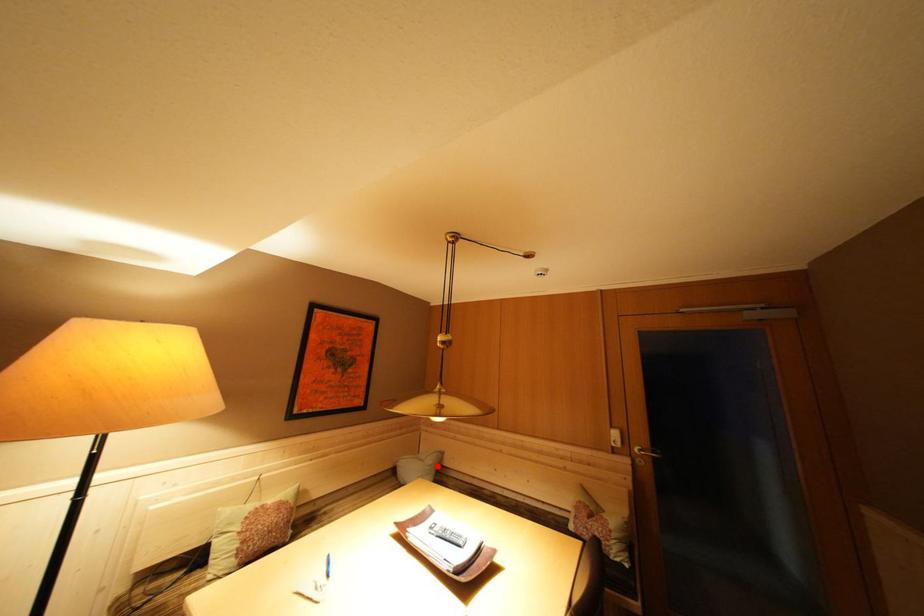
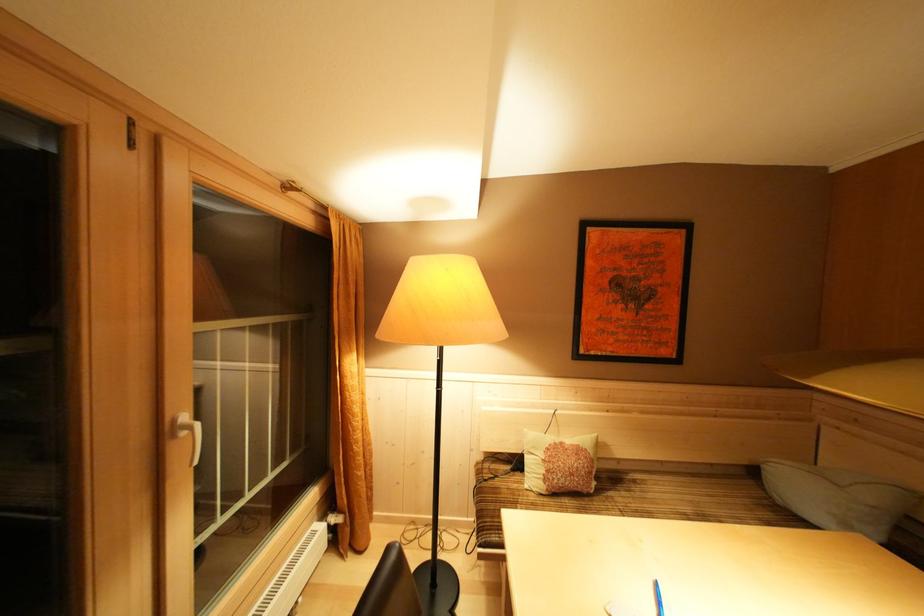
Question: I am providing you with two images of the same scene from different viewpoints. In image1, a red point is highlighted. Considering the same 3D point in image2, which of the following is correct?

Choices:
 (A) It is closer
 (B) It is farther

Answer: (A)